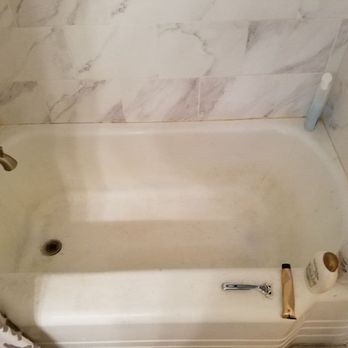
Identify the location of tub cap. The width and height of the screenshot is (348, 348). (287, 264).